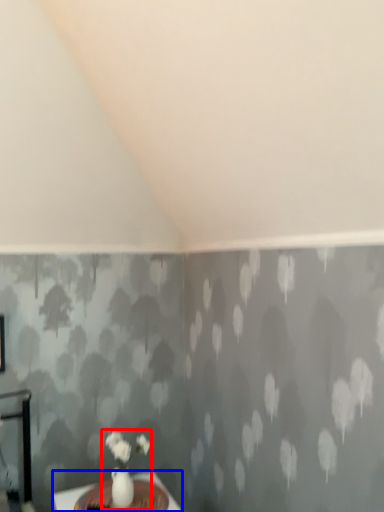
Question: Which object appears farthest to the camera in this image, floral arrangement (highlighted by a red box) or table (highlighted by a blue box)?

Choices:
 (A) floral arrangement
 (B) table

Answer: (A)